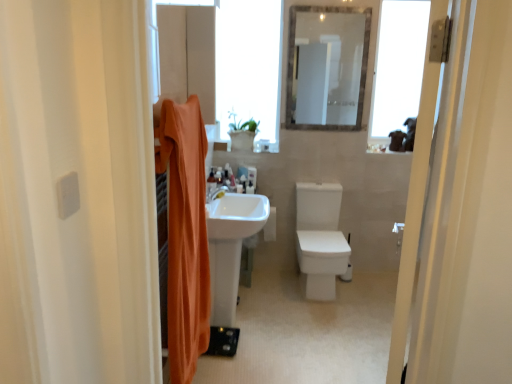
Question: Considering the relative sizes of transparent glass window at upper right, the first window from the right, and orange fabric shower curtain at left in the image provided, is transparent glass window at upper right, the first window from the right, wider than orange fabric shower curtain at left?

Choices:
 (A) no
 (B) yes

Answer: (A)

Question: Does transparent glass window at upper right, arranged as the second window when viewed from the left, have a larger size compared to orange fabric shower curtain at left?

Choices:
 (A) yes
 (B) no

Answer: (B)

Question: Is transparent glass window at upper right, the first window from the right, shorter than orange fabric shower curtain at left?

Choices:
 (A) no
 (B) yes

Answer: (B)

Question: From the image's perspective, is transparent glass window at upper right, arranged as the second window when viewed from the left, on orange fabric shower curtain at left?

Choices:
 (A) yes
 (B) no

Answer: (A)

Question: Can you confirm if transparent glass window at upper right, the first window from the right, is positioned to the left of orange fabric shower curtain at left?

Choices:
 (A) no
 (B) yes

Answer: (A)

Question: Can you confirm if transparent glass window at upper right, the first window from the right, is smaller than orange fabric shower curtain at left?

Choices:
 (A) no
 (B) yes

Answer: (B)

Question: From a real-world perspective, is white glossy sink at center on clear glass mirror at upper center?

Choices:
 (A) yes
 (B) no

Answer: (B)

Question: Could you tell me if white glossy sink at center is facing clear glass mirror at upper center?

Choices:
 (A) no
 (B) yes

Answer: (A)

Question: From the image's perspective, is white glossy sink at center above clear glass mirror at upper center?

Choices:
 (A) no
 (B) yes

Answer: (A)

Question: Could clear glass mirror at upper center be considered to be inside white glossy sink at center?

Choices:
 (A) no
 (B) yes

Answer: (A)

Question: Considering the relative sizes of white glossy sink at center and clear glass mirror at upper center in the image provided, is white glossy sink at center wider than clear glass mirror at upper center?

Choices:
 (A) no
 (B) yes

Answer: (B)

Question: Is white glossy sink at center closer to the viewer compared to clear glass mirror at upper center?

Choices:
 (A) no
 (B) yes

Answer: (B)

Question: Does clear glass mirror at upper center come behind white glossy sink at center?

Choices:
 (A) no
 (B) yes

Answer: (B)